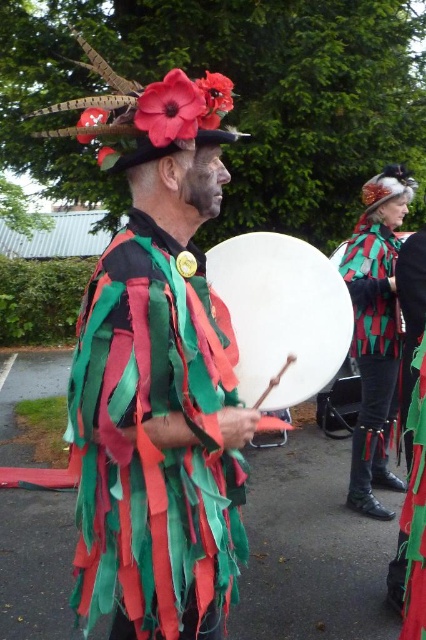
You are standing in the parade and want to find the textured fabric cape at center. According to the coordinates provided, where should you look relative to the central figure?

The textured fabric cape at center is located at coordinates point (155, 444), which means it is positioned to the right and slightly above the central figure.

You are a performer in the parade and need to place your drum on the green textured fabric at center. Can the white leather drum at center fit on the fabric?

The white leather drum at center is thinner than the green textured fabric at center, so it can fit on the fabric.